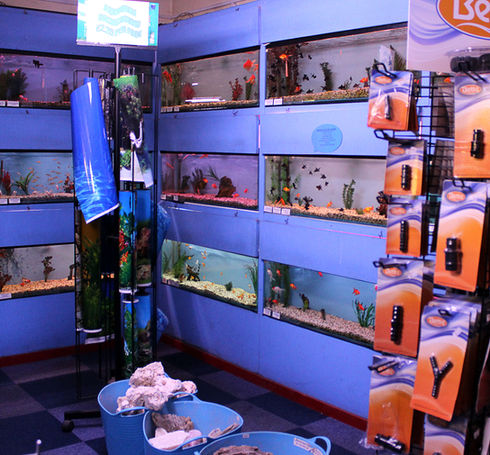
Image resolution: width=490 pixels, height=455 pixels. I want to click on shelving unit for poster display, so click(118, 65).